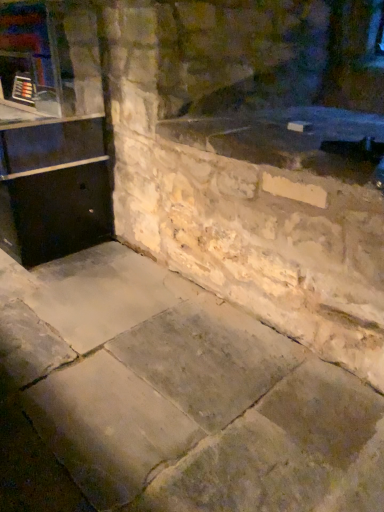
Image resolution: width=384 pixels, height=512 pixels. Describe the element at coordinates (50, 137) in the screenshot. I see `black matte cabinet at left` at that location.

Where is `black matte cabinet at left`? The width and height of the screenshot is (384, 512). black matte cabinet at left is located at coordinates (50, 137).

The image size is (384, 512). I want to click on black matte cabinet at left, so click(x=50, y=137).